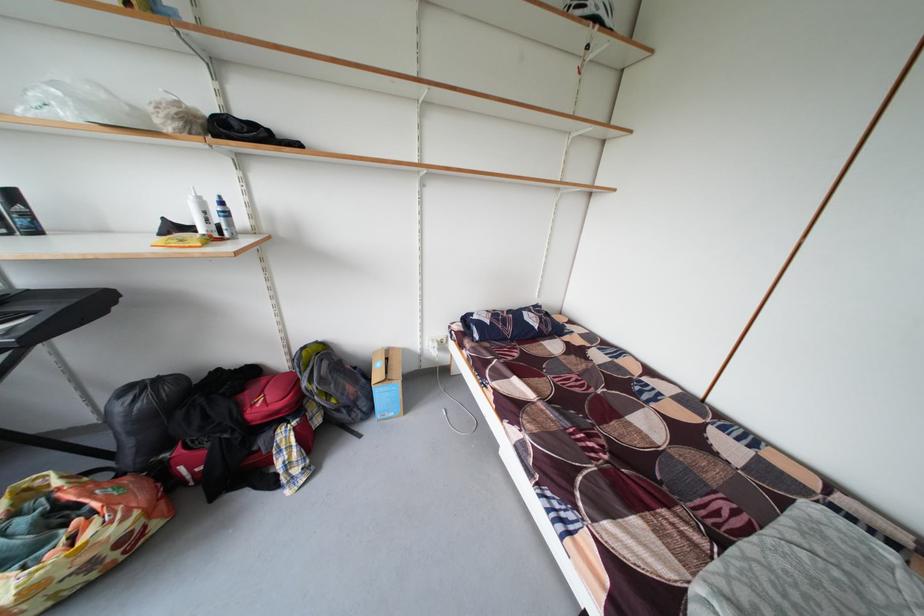
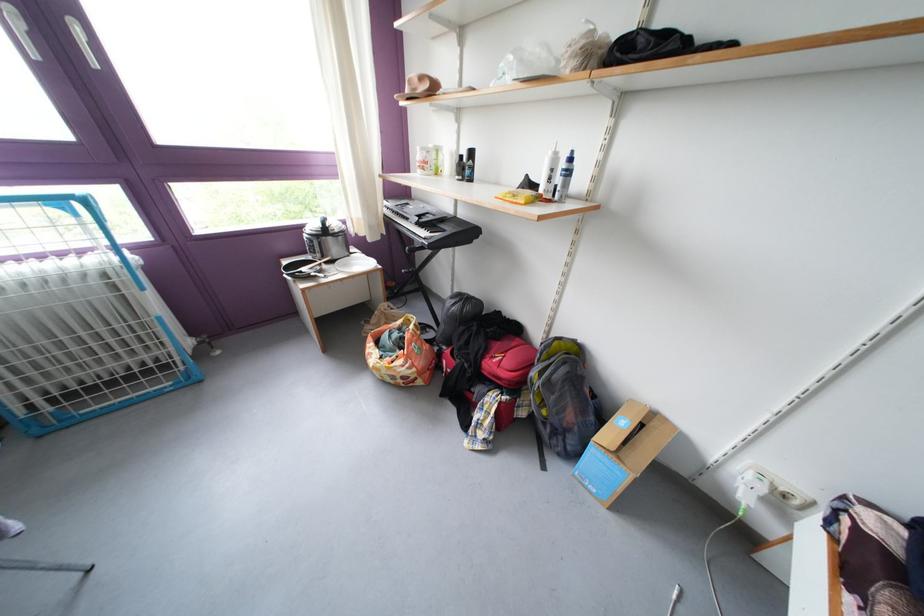
How did the camera likely rotate?

The camera rotated toward left-down.